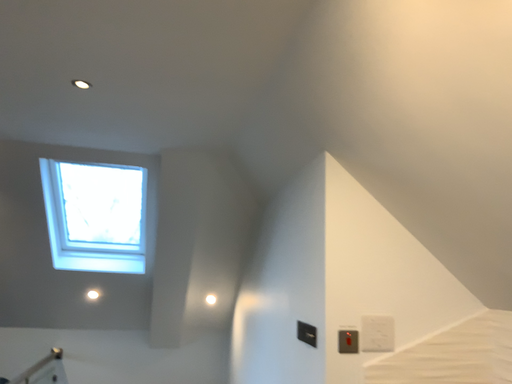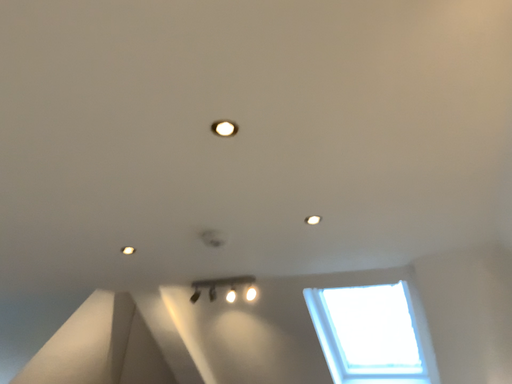
Question: How did the camera likely rotate when shooting the video?

Choices:
 (A) rotated left
 (B) rotated right

Answer: (A)